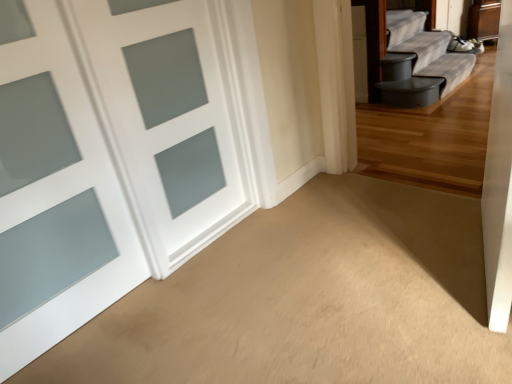
Measure the distance between point (x=179, y=123) and camera.

The distance of point (x=179, y=123) from camera is 6.19 feet.

Describe the element at coordinates (167, 120) in the screenshot. I see `white frosted glass door at left, placed as the 1th door when sorted from right to left` at that location.

Identify the location of white frosted glass door at left, which is the 2th door from left to right. This screenshot has height=384, width=512. (167, 120).

You are a GUI agent. You are given a task and a screenshot of the screen. Output one action in this format:
    pyautogui.click(x=<x>, y=<y>)
    Task: Click on the satin white door at left, the first door in the left-to-right sequence
    The height and width of the screenshot is (384, 512).
    Given the screenshot: What is the action you would take?
    pyautogui.click(x=54, y=193)

In order to face satin white door at left, acting as the second door starting from the right, should I rotate leftwards or rightwards?

It's best to rotate left around 28.608 degrees.

Measure the distance between satin white door at left, acting as the second door starting from the right, and camera.

satin white door at left, acting as the second door starting from the right, is 1.31 meters away from camera.

What do you see at coordinates (54, 193) in the screenshot?
I see `satin white door at left, the first door in the left-to-right sequence` at bounding box center [54, 193].

I want to click on white frosted glass door at left, placed as the 1th door when sorted from right to left, so click(x=167, y=120).

Is white frosted glass door at left, which is the 2th door from left to right, at the right side of satin white door at left, the first door in the left-to-right sequence?

Yes.

Which is in front, white frosted glass door at left, placed as the 1th door when sorted from right to left, or satin white door at left, the first door in the left-to-right sequence?

satin white door at left, the first door in the left-to-right sequence, is in front.

Does point (167, 241) come closer to viewer compared to point (42, 330)?

No, it is not.

From the image's perspective, relative to satin white door at left, acting as the second door starting from the right, is white frosted glass door at left, placed as the 1th door when sorted from right to left, above or below?

white frosted glass door at left, placed as the 1th door when sorted from right to left, is situated higher than satin white door at left, acting as the second door starting from the right, in the image.

In the scene shown: From a real-world perspective, is white frosted glass door at left, which is the 2th door from left to right, above or below satin white door at left, the first door in the left-to-right sequence?

white frosted glass door at left, which is the 2th door from left to right, is below satin white door at left, the first door in the left-to-right sequence.

Considering the relative sizes of white frosted glass door at left, which is the 2th door from left to right, and satin white door at left, acting as the second door starting from the right, in the image provided, is white frosted glass door at left, which is the 2th door from left to right, thinner than satin white door at left, acting as the second door starting from the right,?

No, white frosted glass door at left, which is the 2th door from left to right, is not thinner than satin white door at left, acting as the second door starting from the right.

Can you confirm if white frosted glass door at left, placed as the 1th door when sorted from right to left, is shorter than satin white door at left, acting as the second door starting from the right?

Correct, white frosted glass door at left, placed as the 1th door when sorted from right to left, is not as tall as satin white door at left, acting as the second door starting from the right.

From the picture: Does white frosted glass door at left, placed as the 1th door when sorted from right to left, have a smaller size compared to satin white door at left, acting as the second door starting from the right?

Incorrect, white frosted glass door at left, placed as the 1th door when sorted from right to left, is not smaller in size than satin white door at left, acting as the second door starting from the right.

Is white frosted glass door at left, placed as the 1th door when sorted from right to left, inside the boundaries of satin white door at left, the first door in the left-to-right sequence, or outside?

white frosted glass door at left, placed as the 1th door when sorted from right to left, is spatially situated outside satin white door at left, the first door in the left-to-right sequence.

Are white frosted glass door at left, which is the 2th door from left to right, and satin white door at left, acting as the second door starting from the right, beside each other?

white frosted glass door at left, which is the 2th door from left to right, is not next to satin white door at left, acting as the second door starting from the right, and they're not touching.

Is white frosted glass door at left, placed as the 1th door when sorted from right to left, oriented towards satin white door at left, the first door in the left-to-right sequence?

No, white frosted glass door at left, placed as the 1th door when sorted from right to left, is not turned towards satin white door at left, the first door in the left-to-right sequence.

How distant is white frosted glass door at left, which is the 2th door from left to right, from satin white door at left, the first door in the left-to-right sequence?

The distance of white frosted glass door at left, which is the 2th door from left to right, from satin white door at left, the first door in the left-to-right sequence, is 12.58 inches.

This screenshot has height=384, width=512. In order to click on door above the satin white door at left, the first door in the left-to-right sequence (from the image's perspective) in this screenshot , I will do pos(167,120).

Can you confirm if satin white door at left, acting as the second door starting from the right, is positioned to the right of white frosted glass door at left, placed as the 1th door when sorted from right to left?

No, satin white door at left, acting as the second door starting from the right, is not to the right of white frosted glass door at left, placed as the 1th door when sorted from right to left.

Which object is closer to the camera, satin white door at left, the first door in the left-to-right sequence, or white frosted glass door at left, which is the 2th door from left to right?

Positioned in front is satin white door at left, the first door in the left-to-right sequence.

Does point (45, 63) come closer to viewer compared to point (194, 180)?

Yes.

From the image's perspective, is satin white door at left, the first door in the left-to-right sequence, located above white frosted glass door at left, which is the 2th door from left to right?

No, from the image's perspective, satin white door at left, the first door in the left-to-right sequence, is not on top of white frosted glass door at left, which is the 2th door from left to right.

From a real-world perspective, between satin white door at left, acting as the second door starting from the right, and white frosted glass door at left, placed as the 1th door when sorted from right to left, who is vertically higher?

satin white door at left, acting as the second door starting from the right.

Looking at this image, is satin white door at left, the first door in the left-to-right sequence, wider than white frosted glass door at left, placed as the 1th door when sorted from right to left?

No.

Considering the relative sizes of satin white door at left, acting as the second door starting from the right, and white frosted glass door at left, which is the 2th door from left to right, in the image provided, is satin white door at left, acting as the second door starting from the right, shorter than white frosted glass door at left, which is the 2th door from left to right,?

In fact, satin white door at left, acting as the second door starting from the right, may be taller than white frosted glass door at left, which is the 2th door from left to right.

Considering the relative sizes of satin white door at left, the first door in the left-to-right sequence, and white frosted glass door at left, placed as the 1th door when sorted from right to left, in the image provided, is satin white door at left, the first door in the left-to-right sequence, smaller than white frosted glass door at left, placed as the 1th door when sorted from right to left,?

Correct, satin white door at left, the first door in the left-to-right sequence, occupies less space than white frosted glass door at left, placed as the 1th door when sorted from right to left.

Is satin white door at left, acting as the second door starting from the right, surrounding white frosted glass door at left, placed as the 1th door when sorted from right to left?

Actually, white frosted glass door at left, placed as the 1th door when sorted from right to left, is outside satin white door at left, acting as the second door starting from the right.

Does satin white door at left, the first door in the left-to-right sequence, turn towards white frosted glass door at left, placed as the 1th door when sorted from right to left?

No.

The width and height of the screenshot is (512, 384). What are the coordinates of `door lying on the right of satin white door at left, acting as the second door starting from the right` in the screenshot? It's located at (167, 120).

This screenshot has width=512, height=384. I want to click on door in front of the white frosted glass door at left, which is the 2th door from left to right, so click(54, 193).

Locate an element on the screen. door behind the satin white door at left, the first door in the left-to-right sequence is located at coordinates coord(167,120).